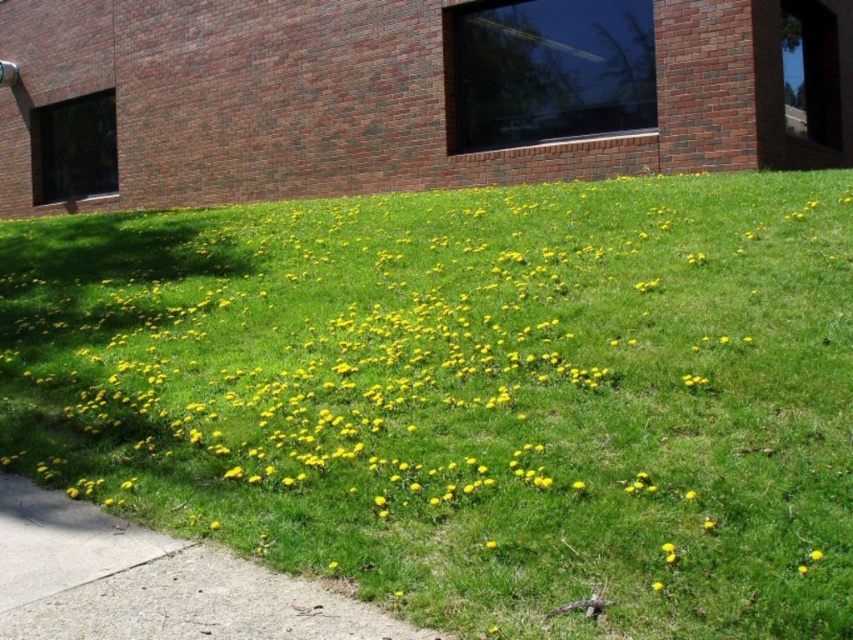
You are standing on the gray concrete sidewalk at lower left and want to walk to the green grass at center. In which direction should you move?

You should move to the right to reach the green grass at center from the gray concrete sidewalk at lower left because the green grass at center is located to the right of the gray concrete sidewalk at lower left.

You are standing on the gray concrete sidewalk at lower left and want to pick the yellow matte flower at center. Which direction should you move to reach the flower?

You should move to the right because the gray concrete sidewalk at lower left is located to the left of the yellow matte flower at center, so moving right will bring you closer to the flower.